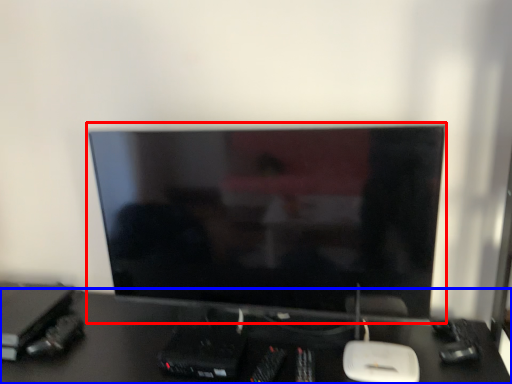
Question: Which point is closer to the camera, computer monitor (highlighted by a red box) or desk (highlighted by a blue box)?

Choices:
 (A) computer monitor
 (B) desk

Answer: (B)